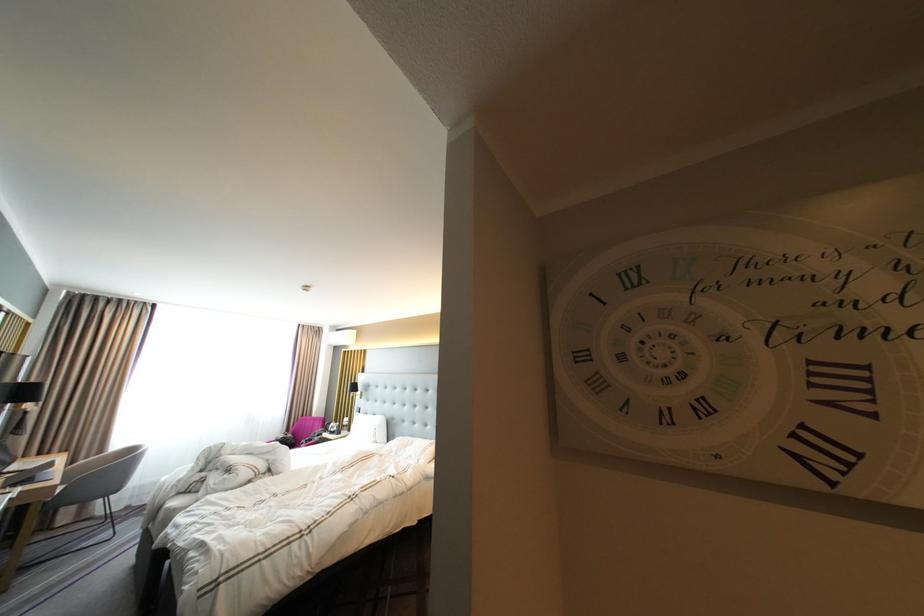
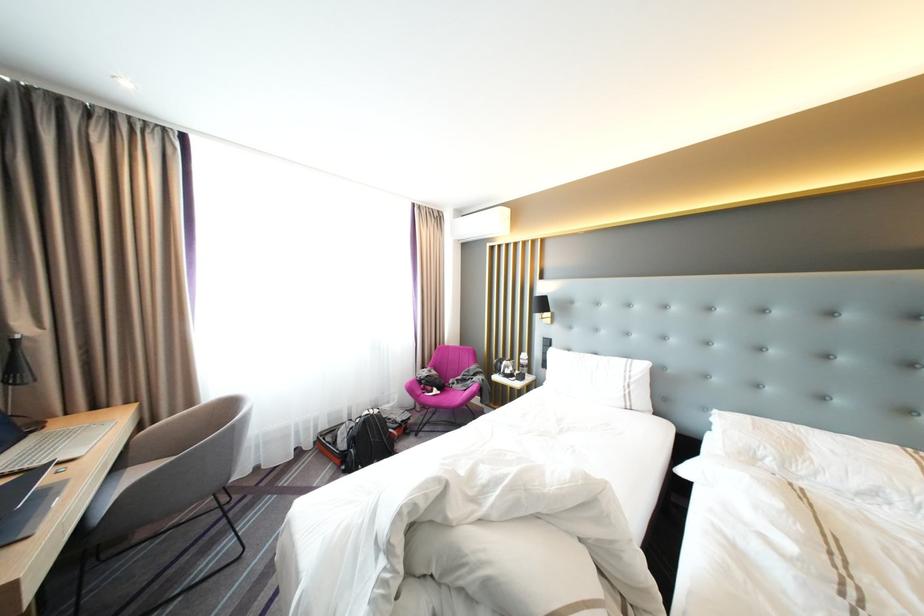
What movement of the cameraman would produce the second image?

The cameraman walked toward left, forward.